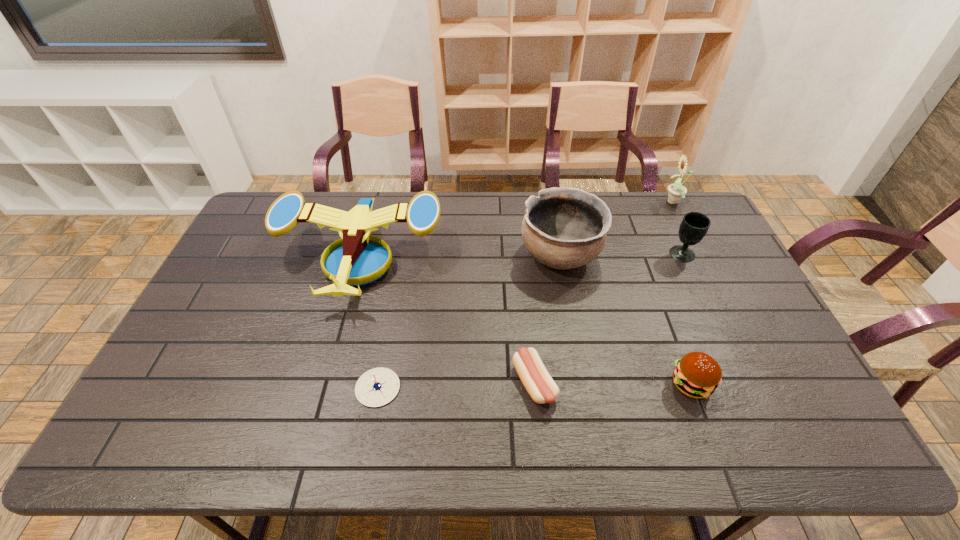
Where is `object present at the left edge`? object present at the left edge is located at coordinates (357, 260).

Identify the location of sunflower that is at the right edge. (676, 191).

The image size is (960, 540). I want to click on chalice that is at the right edge, so click(694, 226).

Identify the location of object located in the far left corner section of the desktop. (357, 260).

Locate an element on the screen. The height and width of the screenshot is (540, 960). object present at the far right corner is located at coordinates (676, 191).

Where is `free space at the far edge of the desktop`? The image size is (960, 540). free space at the far edge of the desktop is located at coordinates (468, 196).

I want to click on vacant area at the near edge of the desktop, so click(662, 450).

Where is `vacant area at the left edge of the desktop`? vacant area at the left edge of the desktop is located at coordinates (282, 245).

Find the location of `free spot at the right edge of the desktop`. free spot at the right edge of the desktop is located at coordinates (738, 367).

Where is `free space between the compass and the sunflower`? free space between the compass and the sunflower is located at coordinates (526, 295).